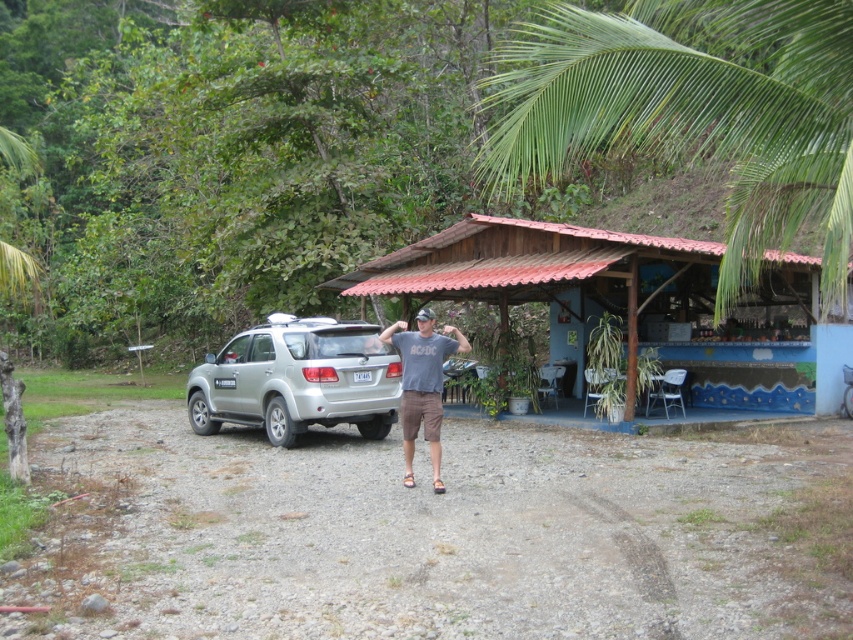
Question: Which of the following is the farthest from the observer?

Choices:
 (A) green leafy palm tree at upper right
 (B) silver metallic suv at center

Answer: (B)

Question: Can you confirm if green leafy palm tree at upper right is smaller than silver metallic suv at center?

Choices:
 (A) yes
 (B) no

Answer: (B)

Question: Is wooden hut at center to the left of silver metallic suv at center from the viewer's perspective?

Choices:
 (A) no
 (B) yes

Answer: (A)

Question: Which point appears farthest from the camera in this image?

Choices:
 (A) (213, 419)
 (B) (614, 68)
 (C) (445, 339)
 (D) (561, 333)

Answer: (D)

Question: Does green leafy palm tree at upper right appear on the right side of wooden hut at center?

Choices:
 (A) no
 (B) yes

Answer: (B)

Question: Which of the following is the farthest from the observer?

Choices:
 (A) matte gray t-shirt at center
 (B) green leafy palm tree at upper right
 (C) silver metallic suv at center

Answer: (C)